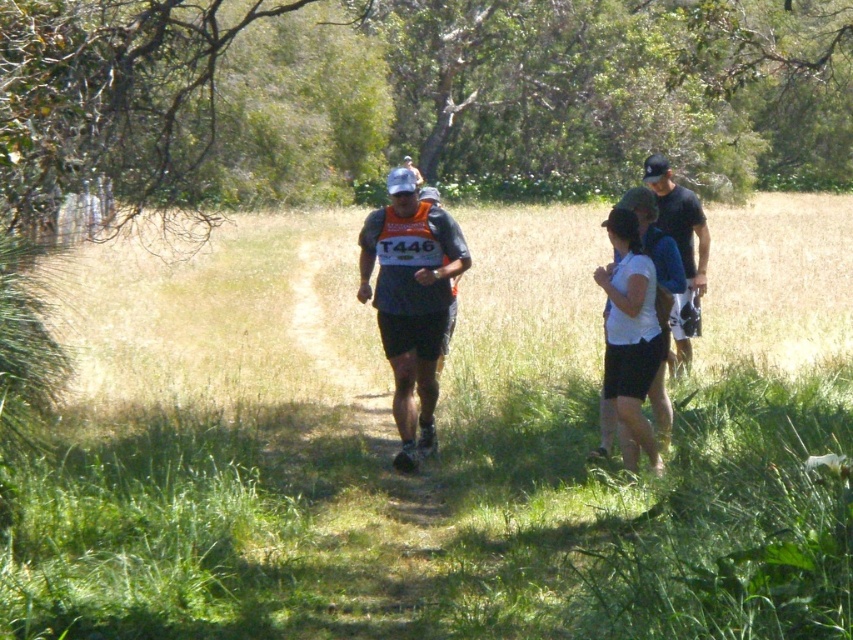
You are a drone operator trying to capture aerial footage of the trail event. You need to ensure that both the point at coordinate (621, 589) and the point at (418, 186) are visible in your shot. Given that the drone is positioned directly above the race path, which direction should you tilt the camera to include both points in the frame?

To include both points in the frame, you should tilt the camera downward because point (621, 589) is closer to the camera than point (418, 186). Tilting downward will allow the camera to capture both the nearer and farther points simultaneously.

Is the white matte shirt at center located to the left or right of the point (630, 337)?

The white matte shirt at center is represented by point (630, 337), so it is exactly at that coordinate.

Based on the photo, you are a photographer positioned at the starting line of the trail running event. You need to capture a photo that includes both the white matte shirt at center and the black fabric shirt at right. Based on their heights, which runner should you focus on first to ensure both are in frame?

The white matte shirt at center is shorter than the black fabric shirt at right. To ensure both are in frame, focus on the taller runner, the black fabric shirt at right, first so that the shorter runner remains visible in the foreground.